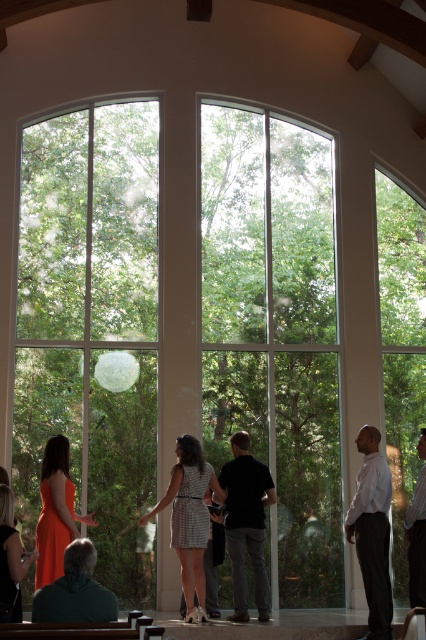
Question: Is clear glass window at right behind white smooth shirt at right?

Choices:
 (A) no
 (B) yes

Answer: (B)

Question: Does plaid fabric dress at center appear over matte orange dress at lower left?

Choices:
 (A) yes
 (B) no

Answer: (B)

Question: Which point appears closest to the camera in this image?

Choices:
 (A) (71, 288)
 (B) (210, 186)

Answer: (A)

Question: Which is nearer to the clear glass window at left?

Choices:
 (A) white matte dress at right
 (B) plaid fabric dress at center

Answer: (B)

Question: Estimate the real-world distances between objects in this image. Which object is closer to the orange satin dress at lower left?

Choices:
 (A) dark green sweater at lower left
 (B) clear glass window at center
 (C) clear glass window at right
 (D) black matte shirt at center

Answer: (A)

Question: Is white smooth shirt at right positioned before plaid fabric dress at center?

Choices:
 (A) yes
 (B) no

Answer: (A)